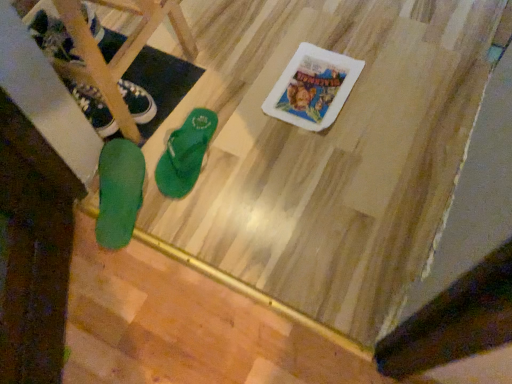
Where is `vacant region to the right of green rubber flip-flop at center, the third footwear from the left`? This screenshot has width=512, height=384. vacant region to the right of green rubber flip-flop at center, the third footwear from the left is located at coordinates (250, 145).